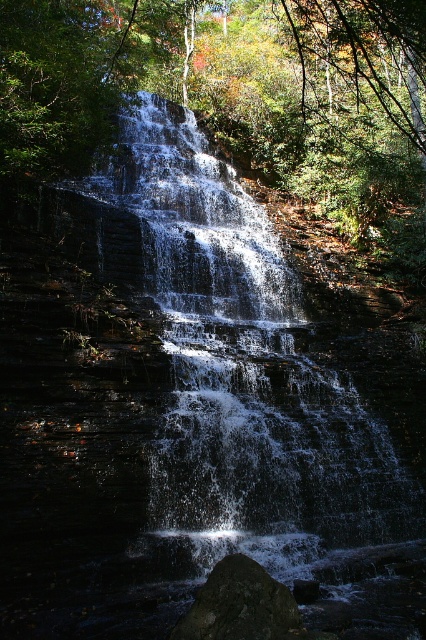
Question: Can you confirm if white frothy water at center is wider than dark gray rock at center?

Choices:
 (A) yes
 (B) no

Answer: (A)

Question: Does white frothy water at center appear over dark gray rock at center?

Choices:
 (A) yes
 (B) no

Answer: (A)

Question: Among these points, which one is farthest from the camera?

Choices:
 (A) (244, 448)
 (B) (190, 632)

Answer: (A)

Question: Is white frothy water at center thinner than dark gray rock at center?

Choices:
 (A) yes
 (B) no

Answer: (B)